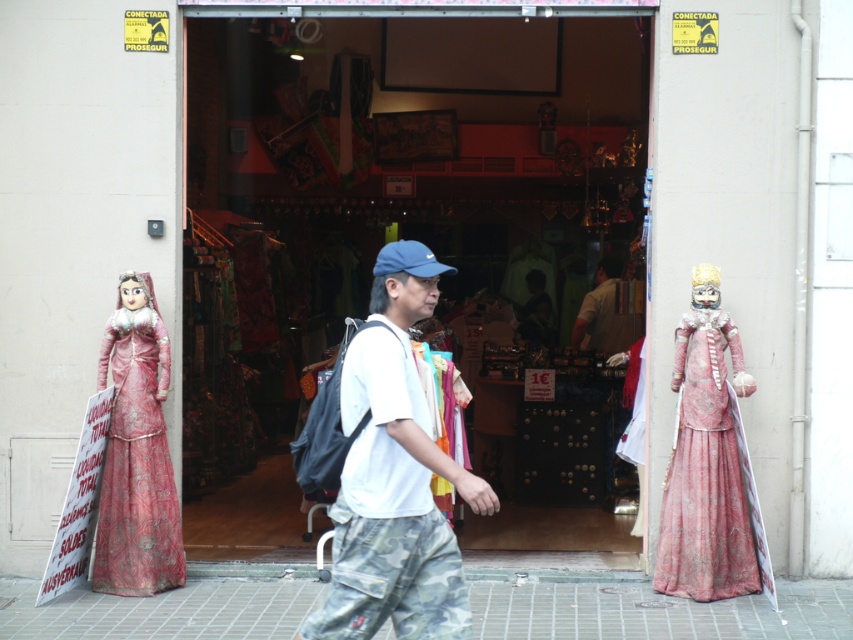
You are a delivery person standing outside the shop. You need to place a large package that is 8 meters long. Can you fit the package between the matte glass shop window at center and the matte pink fabric dress at left?

The distance between the matte glass shop window at center and the matte pink fabric dress at left is 7.83 meters, which is slightly shorter than the package length of 8 meters. Therefore, the package cannot be placed between them.